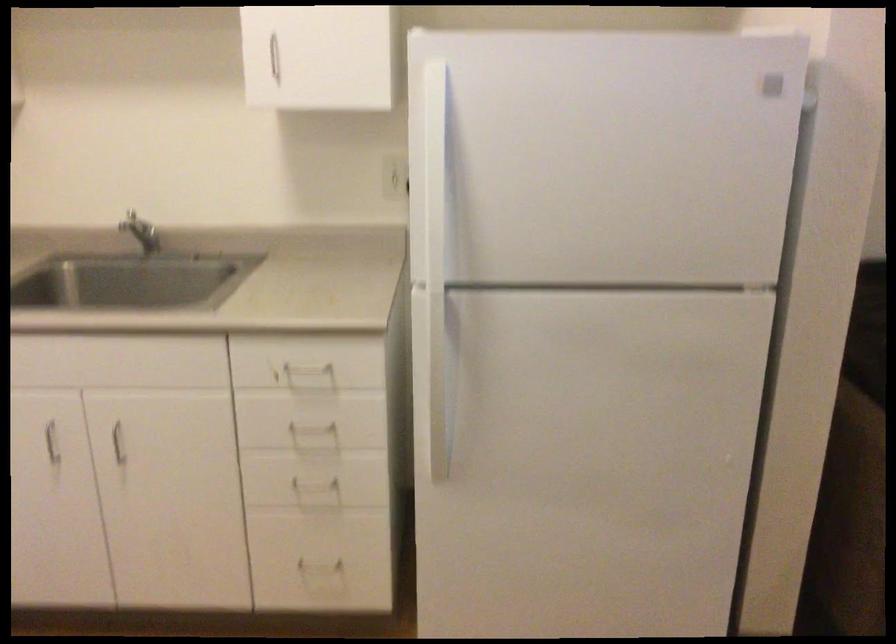
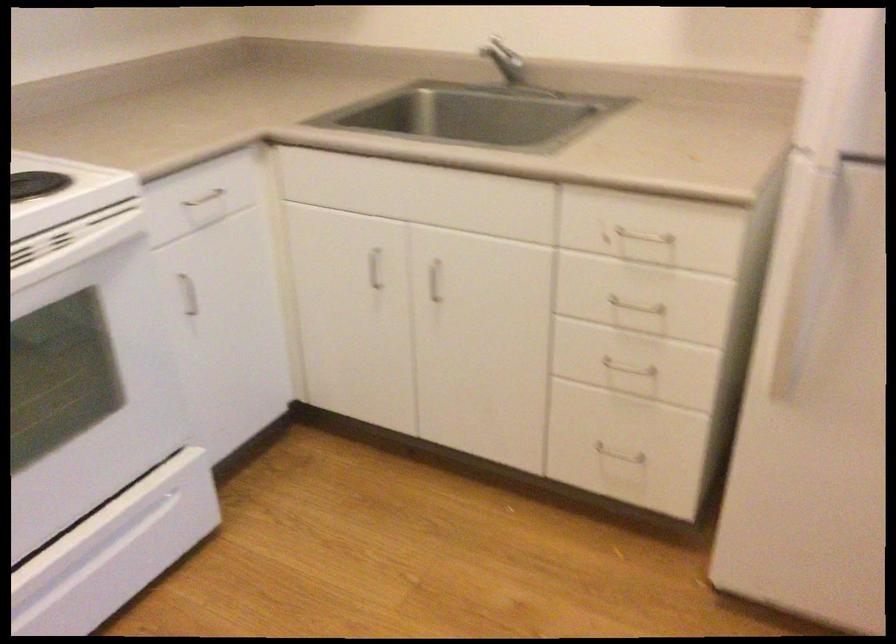
The point at (305,366) is marked in the first image. Where is the corresponding point in the second image?

(639, 236)